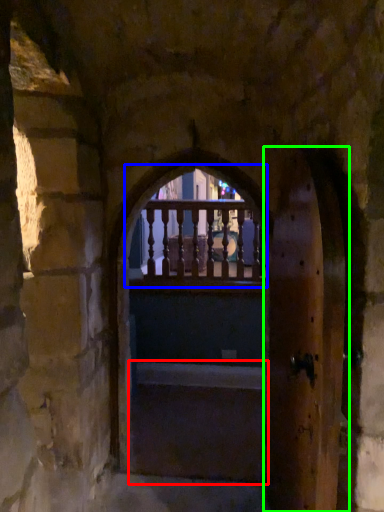
Question: Estimate the real-world distances between objects in this image. Which object is closer to stairs (highlighted by a red box), glass window (highlighted by a blue box) or screen door (highlighted by a green box)?

Choices:
 (A) glass window
 (B) screen door

Answer: (A)